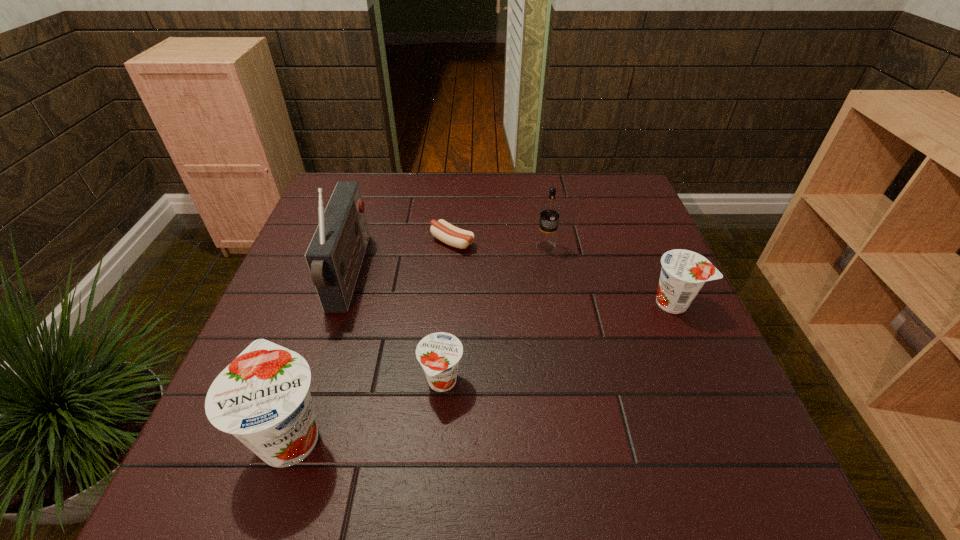
The image size is (960, 540). Find the location of `vacant area situated 0.070m on the left of the rightmost object`. vacant area situated 0.070m on the left of the rightmost object is located at coordinates (618, 302).

Where is `blank space located on the front of the shortest object`? The height and width of the screenshot is (540, 960). blank space located on the front of the shortest object is located at coordinates (445, 345).

Locate an element on the screen. The height and width of the screenshot is (540, 960). vacant space located 0.100m on the front panel of the radio receiver is located at coordinates (402, 275).

The height and width of the screenshot is (540, 960). I want to click on free spot located 0.400m on the label of the second object from right to left, so click(x=569, y=384).

Where is `yogurt that is at the left edge`? This screenshot has height=540, width=960. yogurt that is at the left edge is located at coordinates (262, 397).

Find the location of a particular element. The image size is (960, 540). radio receiver located in the left edge section of the desktop is located at coordinates (335, 254).

Where is `object present at the right edge`? The height and width of the screenshot is (540, 960). object present at the right edge is located at coordinates (684, 272).

Locate an element on the screen. The image size is (960, 540). object that is positioned at the near left corner is located at coordinates (262, 397).

The height and width of the screenshot is (540, 960). I want to click on vacant space at the far edge of the desktop, so click(x=408, y=176).

Find the location of a particular element. free space at the near edge of the desktop is located at coordinates pyautogui.click(x=638, y=404).